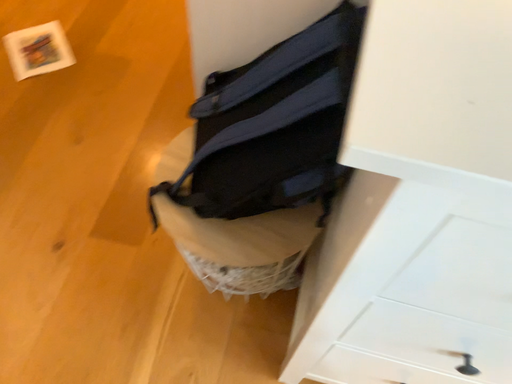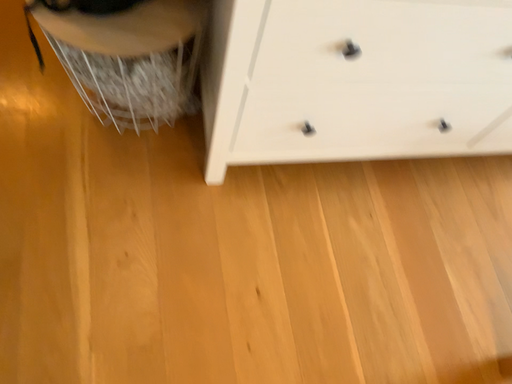
Question: How did the camera likely rotate when shooting the video?

Choices:
 (A) rotated right
 (B) rotated left

Answer: (A)